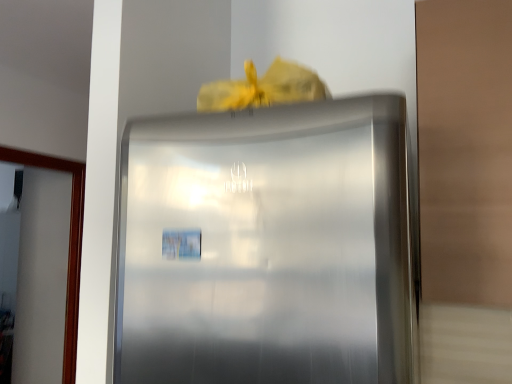
Question: Visually, is satin silver refrigerator at center positioned to the left or to the right of transparent glass door at left?

Choices:
 (A) left
 (B) right

Answer: (B)

Question: In terms of width, does satin silver refrigerator at center look wider or thinner when compared to transparent glass door at left?

Choices:
 (A) wide
 (B) thin

Answer: (A)

Question: From the image's perspective, is satin silver refrigerator at center located above or below transparent glass door at left?

Choices:
 (A) above
 (B) below

Answer: (A)

Question: From the image's perspective, is transparent glass door at left above or below satin silver refrigerator at center?

Choices:
 (A) below
 (B) above

Answer: (A)

Question: Is transparent glass door at left in front of or behind satin silver refrigerator at center in the image?

Choices:
 (A) front
 (B) behind

Answer: (B)

Question: Choose the correct answer: Is transparent glass door at left inside satin silver refrigerator at center or outside it?

Choices:
 (A) inside
 (B) outside

Answer: (B)

Question: Would you say transparent glass door at left is to the left or to the right of satin silver refrigerator at center in the picture?

Choices:
 (A) right
 (B) left

Answer: (B)